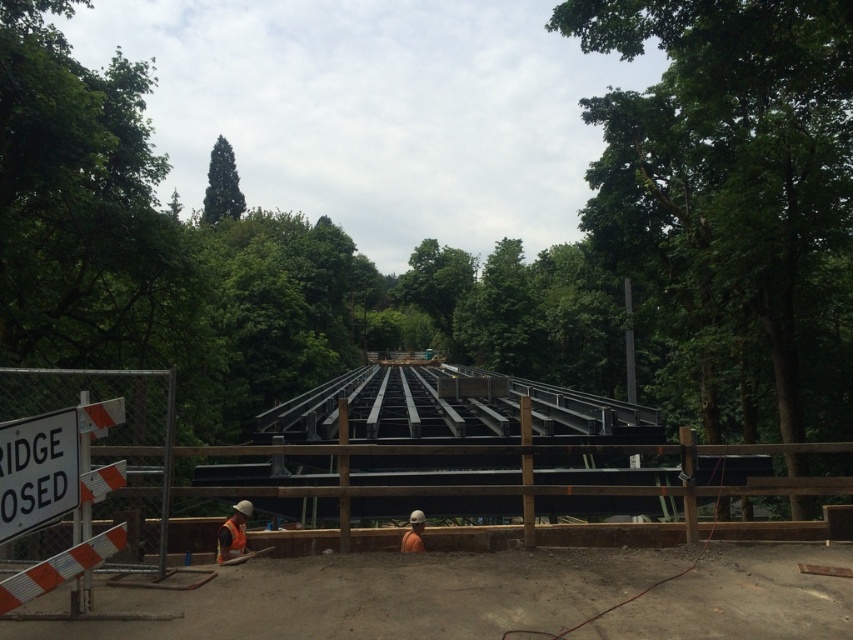
Which of these two, black steel beams at center or orange safety vest at lower center, stands taller?

black steel beams at center

Does black steel beams at center have a lesser width compared to orange safety vest at lower center?

No.

Which is in front, point (233, 566) or point (410, 548)?

Point (233, 566) is in front.

The height and width of the screenshot is (640, 853). I want to click on black steel beams at center, so click(x=339, y=593).

Is orange fabric safety vest at lower center smaller than orange safety vest at lower center?

Actually, orange fabric safety vest at lower center might be larger than orange safety vest at lower center.

This screenshot has width=853, height=640. In order to click on orange fabric safety vest at lower center in this screenshot , I will do `click(230, 540)`.

Is point (233, 541) less distant than point (409, 515)?

Yes.

The width and height of the screenshot is (853, 640). Identify the location of orange fabric safety vest at lower center. (230, 540).

Is black steel beams at center taller than orange fabric safety vest at lower center?

Correct, black steel beams at center is much taller as orange fabric safety vest at lower center.

Does black steel beams at center have a greater width compared to orange fabric safety vest at lower center?

Yes, black steel beams at center is wider than orange fabric safety vest at lower center.

Does point (410, 490) come farther from viewer compared to point (231, 520)?

That is False.

Where is `black steel beams at center`? Image resolution: width=853 pixels, height=640 pixels. black steel beams at center is located at coordinates (339, 593).